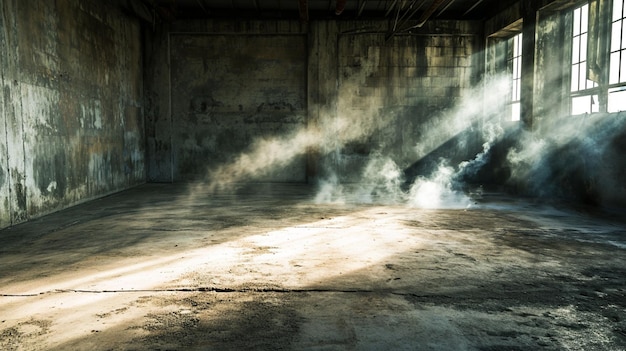
You are a GUI agent. You are given a task and a screenshot of the screen. Output one action in this format:
    pyautogui.click(x=<x>, y=<y>)
    Task: Click on the concrete  floor
    
    Given the screenshot: What is the action you would take?
    pyautogui.click(x=303, y=259)